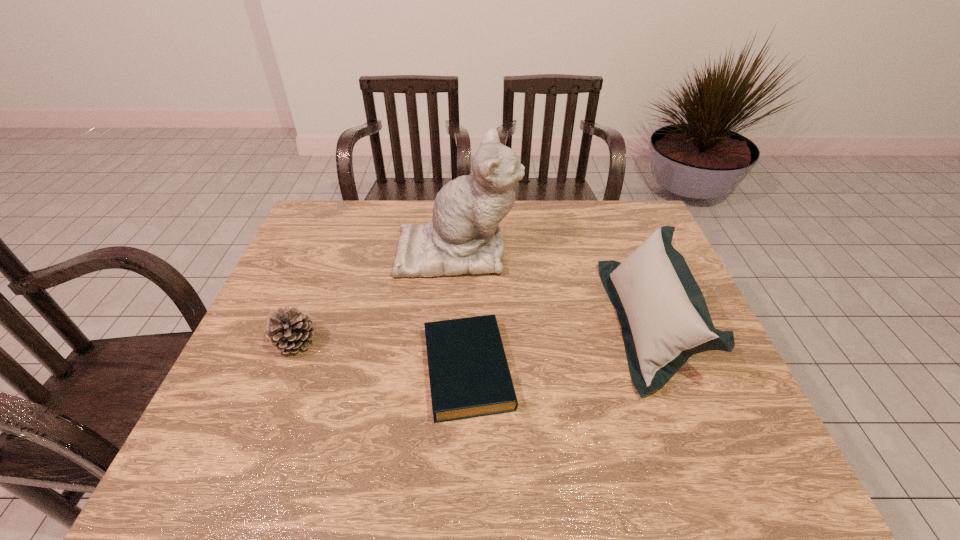
What are the coordinates of `blank area located 0.180m on the right of the pinecone` in the screenshot? It's located at (390, 343).

Locate an element on the screen. Image resolution: width=960 pixels, height=540 pixels. free region located on the right of the shortest object is located at coordinates (649, 369).

Where is `object present at the far edge`? object present at the far edge is located at coordinates (463, 237).

Where is `object present at the left edge`? object present at the left edge is located at coordinates (290, 331).

Identify the location of object at the right edge. Image resolution: width=960 pixels, height=540 pixels. (664, 318).

In the image, there is a desktop. Where is `free space at the far edge`? free space at the far edge is located at coordinates (564, 208).

Identify the location of free spot at the near edge of the desktop. (573, 456).

Find the location of a particular element. The image size is (960, 540). vacant space at the left edge is located at coordinates (252, 404).

Find the location of a particular element. vacant region at the right edge is located at coordinates (706, 386).

Where is `vacant space at the far left corner of the desktop`? The image size is (960, 540). vacant space at the far left corner of the desktop is located at coordinates 338,205.